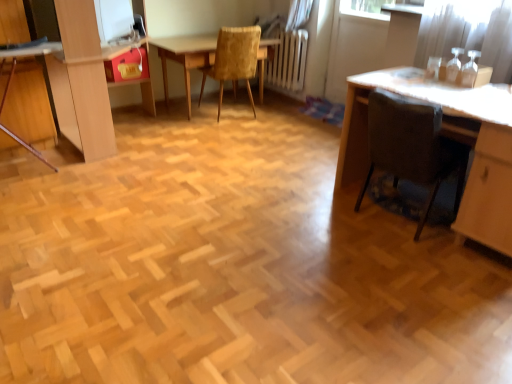
At what (x,y) coordinates should I click in order to perform the action: click on vacant space in front of brown fabric chair at lower right, the second chair viewed from the left. Please return your answer as a coordinate pair (x, y). Looking at the image, I should click on coord(417,266).